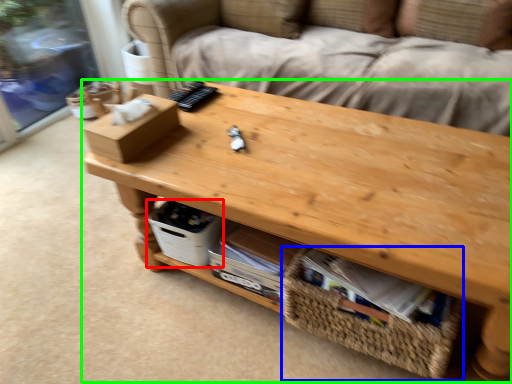
Question: Estimate the real-world distances between objects in this image. Which object is closer to storage box (highlighted by a red box), basket (highlighted by a blue box) or table (highlighted by a green box)?

Choices:
 (A) basket
 (B) table

Answer: (B)